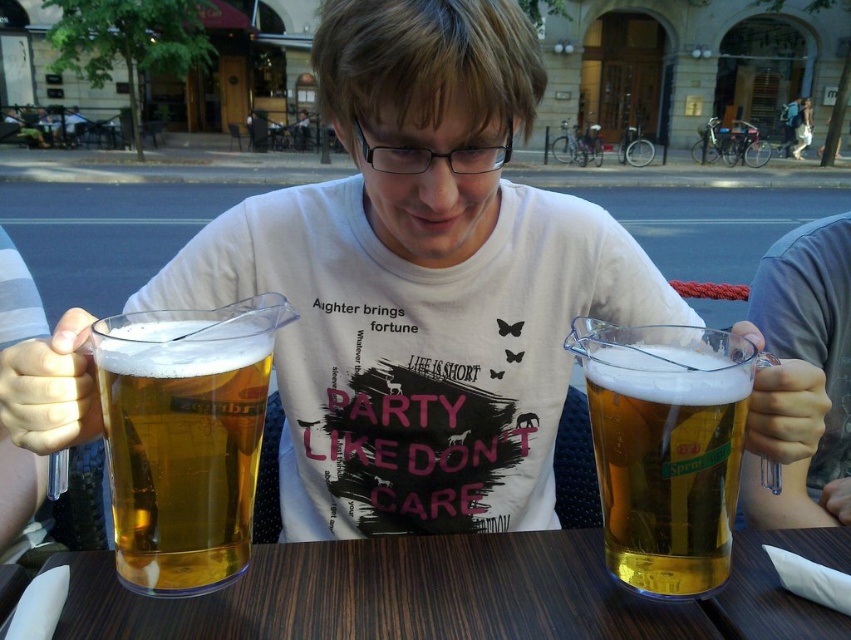
Who is positioned more to the right, wooden table at center or golden glass mug at left?

Positioned to the right is wooden table at center.

Between point (492, 624) and point (193, 461), which one is positioned behind?

Positioned behind is point (492, 624).

Image resolution: width=851 pixels, height=640 pixels. Find the location of `wooden table at center`. wooden table at center is located at coordinates (457, 593).

Can you confirm if golden glass mug at left is wider than translucent plastic mug at center?

No.

This screenshot has height=640, width=851. Describe the element at coordinates (181, 444) in the screenshot. I see `golden glass mug at left` at that location.

Image resolution: width=851 pixels, height=640 pixels. In order to click on golden glass mug at left in this screenshot , I will do `click(181, 444)`.

In the scene shown: Who is positioned more to the left, wooden table at center or translucent plastic mug at center?

Positioned to the left is wooden table at center.

Can you confirm if wooden table at center is positioned to the left of translucent plastic mug at center?

Correct, you'll find wooden table at center to the left of translucent plastic mug at center.

In order to click on wooden table at center in this screenshot , I will do `click(457, 593)`.